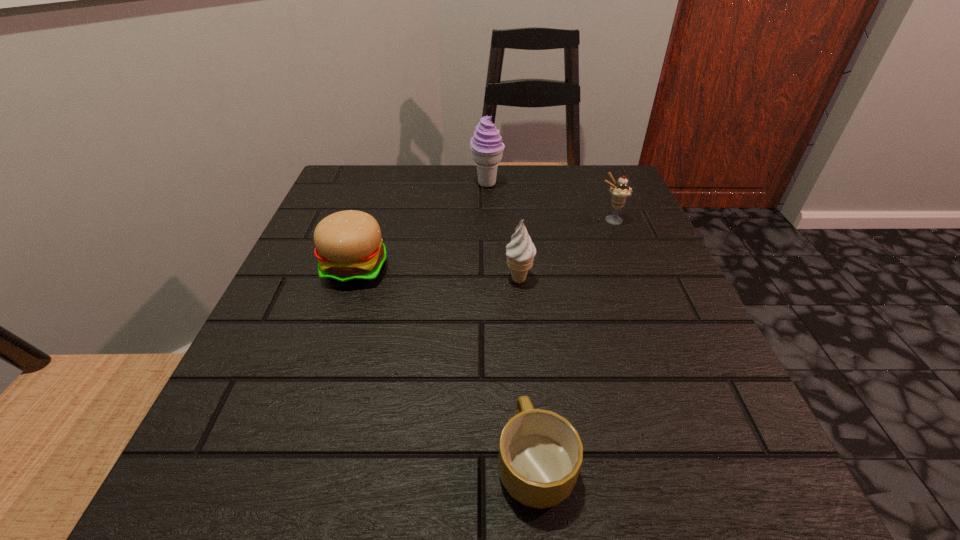
I want to click on vacant space that's between the shortest object and the leftmost object, so pos(445,366).

Locate an element on the screen. This screenshot has height=540, width=960. empty space between the shortest object and the farthest icecream is located at coordinates (511, 323).

I want to click on empty location between the leftmost object and the nearest icecream, so click(x=438, y=274).

Locate an element on the screen. The width and height of the screenshot is (960, 540). free point between the hamburger and the shortest object is located at coordinates tap(445, 366).

Identify the location of free space between the nearest icecream and the shortest object. (527, 371).

Identify which object is the third closest to the farthest object. Please provide its 2D coordinates. Your answer should be formatted as a tuple, i.e. [(x, y)], where the tuple contains the x and y coordinates of a point satisfying the conditions above.

[(520, 252)]

Locate which object is the third closest to the tallest icecream. Please provide its 2D coordinates. Your answer should be formatted as a tuple, i.e. [(x, y)], where the tuple contains the x and y coordinates of a point satisfying the conditions above.

[(520, 252)]

You are a GUI agent. You are given a task and a screenshot of the screen. Output one action in this format:
    pyautogui.click(x=<x>, y=<y>)
    Task: Click on the icecream that is the second closest to the nearest icecream
    
    Given the screenshot: What is the action you would take?
    point(486,145)

Where is `the closest icecream to the hamburger`? This screenshot has width=960, height=540. the closest icecream to the hamburger is located at coordinates (520, 252).

The width and height of the screenshot is (960, 540). Find the location of `free location that satisfies the following two spatial constraints: 1. on the side with the handle of the shortest object; 2. on the left side of the rightmost icecream`. free location that satisfies the following two spatial constraints: 1. on the side with the handle of the shortest object; 2. on the left side of the rightmost icecream is located at coordinates (512, 220).